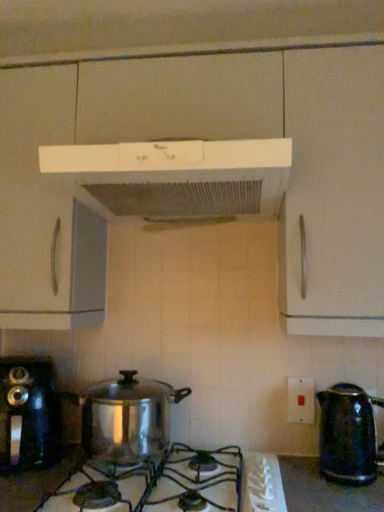
Question: Should I look upward or downward to see white plastic switch at center-right?

Choices:
 (A) down
 (B) up

Answer: (A)

Question: Is white matte range hood at upper center aimed at shiny metallic gas stove at center?

Choices:
 (A) yes
 (B) no

Answer: (B)

Question: Does white matte range hood at upper center have a smaller size compared to shiny metallic gas stove at center?

Choices:
 (A) no
 (B) yes

Answer: (A)

Question: From the image's perspective, is white matte range hood at upper center below shiny metallic gas stove at center?

Choices:
 (A) no
 (B) yes

Answer: (A)

Question: From a real-world perspective, is white matte range hood at upper center positioned under shiny metallic gas stove at center based on gravity?

Choices:
 (A) no
 (B) yes

Answer: (A)

Question: Is shiny metallic gas stove at center completely or partially inside white matte range hood at upper center?

Choices:
 (A) yes
 (B) no

Answer: (B)

Question: Can you confirm if white matte range hood at upper center is positioned to the right of shiny metallic gas stove at center?

Choices:
 (A) yes
 (B) no

Answer: (A)

Question: Is shiny black kettle at right completely or partially outside of shiny metallic gas stove at center?

Choices:
 (A) yes
 (B) no

Answer: (A)

Question: Does shiny black kettle at right lie behind shiny metallic gas stove at center?

Choices:
 (A) no
 (B) yes

Answer: (B)

Question: Is the position of shiny black kettle at right less distant than that of shiny metallic gas stove at center?

Choices:
 (A) no
 (B) yes

Answer: (A)

Question: From a real-world perspective, is shiny black kettle at right below shiny metallic gas stove at center?

Choices:
 (A) yes
 (B) no

Answer: (B)

Question: Is shiny black kettle at right at the right side of shiny metallic gas stove at center?

Choices:
 (A) yes
 (B) no

Answer: (A)

Question: Is shiny black kettle at right wider than shiny metallic gas stove at center?

Choices:
 (A) yes
 (B) no

Answer: (B)

Question: Is shiny black kettle at right taller than white matte range hood at upper center?

Choices:
 (A) yes
 (B) no

Answer: (A)